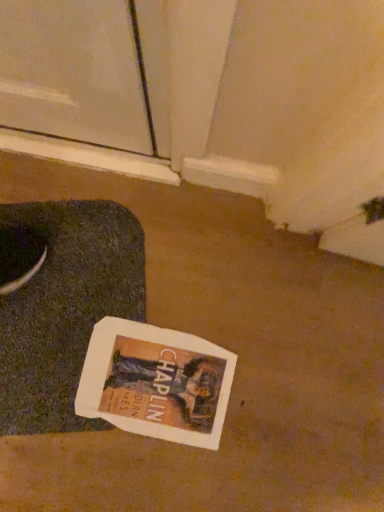
Question: Can you confirm if dark gray textured yoga mat at lower left is taller than white paper magazine at center?

Choices:
 (A) yes
 (B) no

Answer: (A)

Question: Is dark gray textured yoga mat at lower left at the right side of white paper magazine at center?

Choices:
 (A) yes
 (B) no

Answer: (B)

Question: Considering the relative sizes of dark gray textured yoga mat at lower left and white paper magazine at center in the image provided, is dark gray textured yoga mat at lower left thinner than white paper magazine at center?

Choices:
 (A) yes
 (B) no

Answer: (B)

Question: Can white paper magazine at center be found inside dark gray textured yoga mat at lower left?

Choices:
 (A) no
 (B) yes

Answer: (B)

Question: Is dark gray textured yoga mat at lower left closer to the viewer compared to white paper magazine at center?

Choices:
 (A) no
 (B) yes

Answer: (B)

Question: Is dark gray textured yoga mat at lower left placed right next to white paper magazine at center?

Choices:
 (A) yes
 (B) no

Answer: (B)

Question: Considering the relative sizes of white paper magazine at center and dark gray textured yoga mat at lower left in the image provided, is white paper magazine at center taller than dark gray textured yoga mat at lower left?

Choices:
 (A) no
 (B) yes

Answer: (A)

Question: Can you confirm if white paper magazine at center is positioned to the right of dark gray textured yoga mat at lower left?

Choices:
 (A) no
 (B) yes

Answer: (B)

Question: Could you tell me if white paper magazine at center is facing dark gray textured yoga mat at lower left?

Choices:
 (A) yes
 (B) no

Answer: (A)

Question: Is white paper magazine at center not inside dark gray textured yoga mat at lower left?

Choices:
 (A) yes
 (B) no

Answer: (B)

Question: Is there a large distance between white paper magazine at center and dark gray textured yoga mat at lower left?

Choices:
 (A) no
 (B) yes

Answer: (A)

Question: Is white paper magazine at center further to camera compared to dark gray textured yoga mat at lower left?

Choices:
 (A) no
 (B) yes

Answer: (B)

Question: Is point (122, 331) closer or farther from the camera than point (79, 207)?

Choices:
 (A) closer
 (B) farther

Answer: (A)